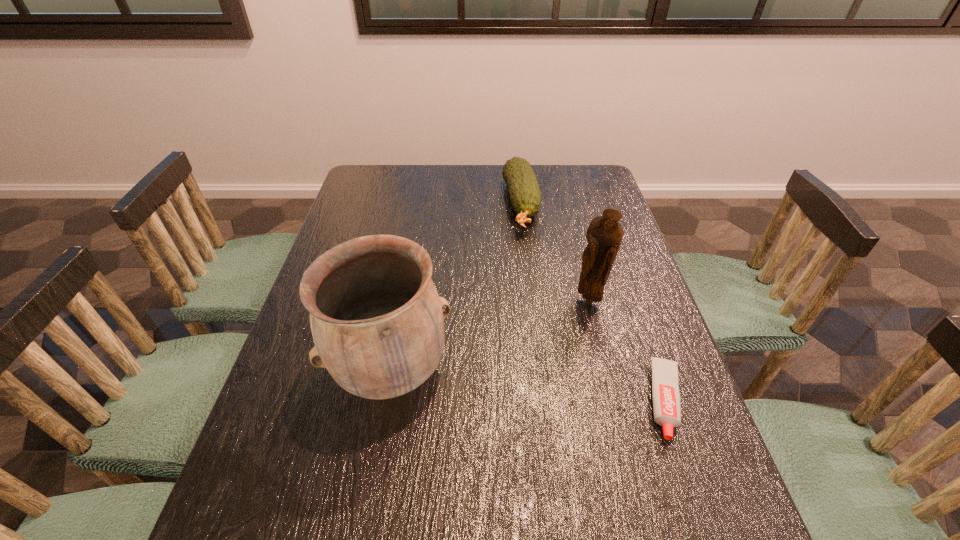
At what (x,y) coordinates should I click in order to perform the action: click on free space on the desktop that is between the urn and the shortest object and is positioned at the blossom end of the farthest object. Please return your answer as a coordinate pair (x, y). Image resolution: width=960 pixels, height=540 pixels. Looking at the image, I should click on point(563,389).

You are a GUI agent. You are given a task and a screenshot of the screen. Output one action in this format:
    pyautogui.click(x=<x>, y=<y>)
    Task: Click on the free spot on the desktop that is between the urn and the shortest object and is positioned on the front-facing side of the second farthest object
    
    Given the screenshot: What is the action you would take?
    pyautogui.click(x=499, y=382)